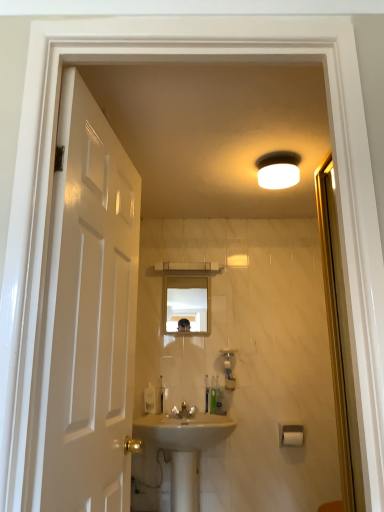
Question: From the image's perspective, is clear glass mirror at center under transparent glass screen door at right?

Choices:
 (A) no
 (B) yes

Answer: (B)

Question: Is clear glass mirror at center placed right next to transparent glass screen door at right?

Choices:
 (A) yes
 (B) no

Answer: (B)

Question: Does clear glass mirror at center have a smaller size compared to transparent glass screen door at right?

Choices:
 (A) no
 (B) yes

Answer: (B)

Question: Can we say clear glass mirror at center lies outside transparent glass screen door at right?

Choices:
 (A) yes
 (B) no

Answer: (A)

Question: Is clear glass mirror at center to the right of transparent glass screen door at right from the viewer's perspective?

Choices:
 (A) yes
 (B) no

Answer: (B)

Question: Can you confirm if clear glass mirror at center is shorter than transparent glass screen door at right?

Choices:
 (A) no
 (B) yes

Answer: (B)

Question: Are glossy white door at left and beige ceramic sink at center located far from each other?

Choices:
 (A) no
 (B) yes

Answer: (B)

Question: Is glossy white door at left looking in the opposite direction of beige ceramic sink at center?

Choices:
 (A) no
 (B) yes

Answer: (A)

Question: Does glossy white door at left appear on the right side of beige ceramic sink at center?

Choices:
 (A) no
 (B) yes

Answer: (A)

Question: Is the position of glossy white door at left less distant than that of beige ceramic sink at center?

Choices:
 (A) no
 (B) yes

Answer: (B)

Question: From a real-world perspective, does glossy white door at left sit lower than beige ceramic sink at center?

Choices:
 (A) no
 (B) yes

Answer: (A)

Question: Is glossy white door at left placed right next to beige ceramic sink at center?

Choices:
 (A) no
 (B) yes

Answer: (A)

Question: Considering the relative sizes of translucent plastic toothbrush at center, the second toiletry positioned from the right, and white plastic toothbrush at center, the fifth toiletry in the right-to-left sequence, in the image provided, is translucent plastic toothbrush at center, the second toiletry positioned from the right, wider than white plastic toothbrush at center, the fifth toiletry in the right-to-left sequence,?

Choices:
 (A) yes
 (B) no

Answer: (B)